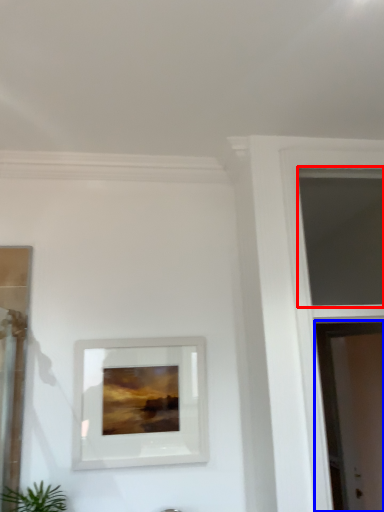
Question: Which object appears farthest to the camera in this image, window (highlighted by a red box) or screen door (highlighted by a blue box)?

Choices:
 (A) window
 (B) screen door

Answer: (B)